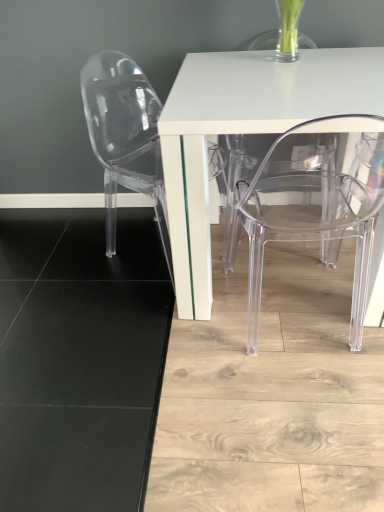
Image resolution: width=384 pixels, height=512 pixels. What are the coordinates of `vacant area that lies between white glossy table at center and transparent acrylic chair at lower right, the first chair when ordered from right to left` in the screenshot? It's located at (235, 336).